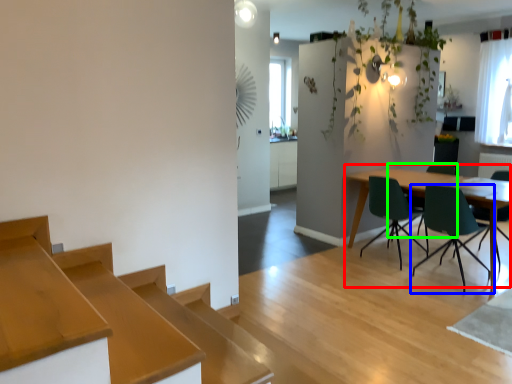
Question: Which object is the farthest from table (highlighted by a red box)? Choose among these: chair (highlighted by a blue box) or chair (highlighted by a green box).

Choices:
 (A) chair
 (B) chair

Answer: (B)